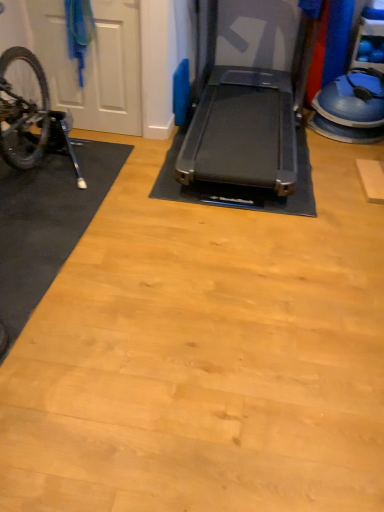
In order to face black rubber treadmill at center, should I rotate leftwards or rightwards?

Turn right by 8.000 degrees to look at black rubber treadmill at center.

What do you see at coordinates (93, 65) in the screenshot?
I see `white matte door at left` at bounding box center [93, 65].

What is the approximate width of black rubber mat at left?

The width of black rubber mat at left is 34.91 inches.

Identify the location of black rubber treadmill at center. (250, 135).

Is shiny metallic bicycle at left completely or partially inside black rubber treadmill at center?

Definitely not — shiny metallic bicycle at left is not inside black rubber treadmill at center.

Which object is closer to the camera taking this photo, black rubber treadmill at center or shiny metallic bicycle at left?

Positioned in front is black rubber treadmill at center.

How different are the orientations of black rubber treadmill at center and shiny metallic bicycle at left in degrees?

They differ by 0.608 degrees in their facing directions.

Does point (248, 179) appear closer or farther from the camera than point (37, 105)?

Point (248, 179).

Looking at this image, measure the distance from black rubber treadmill at center to white matte door at left.

A distance of 35.71 inches exists between black rubber treadmill at center and white matte door at left.

From the image's perspective, is black rubber treadmill at center above white matte door at left?

Yes, from the image's perspective, black rubber treadmill at center is on top of white matte door at left.

Which is closer to the camera, (x=272, y=111) or (x=101, y=25)?

The point (x=101, y=25) is more forward.

Is white matte door at left inside black rubber treadmill at center?

Definitely not — white matte door at left is not inside black rubber treadmill at center.

In the image, there is a black rubber treadmill at center. In order to click on bicycle below it (from the image's perspective) in this screenshot , I will do `click(30, 114)`.

Is shiny metallic bicycle at left with black rubber treadmill at center?

No, shiny metallic bicycle at left is not with black rubber treadmill at center.

From a real-world perspective, which is physically below, shiny metallic bicycle at left or black rubber treadmill at center?

In real-world perspective, shiny metallic bicycle at left is lower.

Does point (21, 141) appear closer or farther from the camera than point (307, 210)?

Point (21, 141).

From a real-world perspective, is white matte door at left located higher than black rubber mat at left?

Yes, from a real-world perspective, white matte door at left is over black rubber mat at left

Considering the sizes of white matte door at left and black rubber mat at left in the image, is white matte door at left bigger or smaller than black rubber mat at left?

Considering their sizes, white matte door at left takes up less space than black rubber mat at left.

Where is `garage door located above the black rubber mat at left (from a real-world perspective)`? This screenshot has height=512, width=384. garage door located above the black rubber mat at left (from a real-world perspective) is located at coordinates (93, 65).

Can you confirm if white matte door at left is wider than black rubber mat at left?

In fact, white matte door at left might be narrower than black rubber mat at left.

From a real-world perspective, is black rubber mat at left located beneath shiny metallic bicycle at left?

Yes, from a real-world perspective, black rubber mat at left is under shiny metallic bicycle at left.

Between black rubber mat at left and shiny metallic bicycle at left, which one is positioned behind?

Positioned behind is shiny metallic bicycle at left.

Between black rubber mat at left and shiny metallic bicycle at left, which one appears on the left side from the viewer's perspective?

black rubber mat at left is more to the left.

From the image's perspective, is black rubber mat at left positioned above or below shiny metallic bicycle at left?

black rubber mat at left is below shiny metallic bicycle at left.

From a real-world perspective, is black rubber mat at left positioned above or below black rubber treadmill at center?

From a real-world perspective, black rubber mat at left is physically below black rubber treadmill at center.

In the scene shown: Is black rubber mat at left far away from black rubber treadmill at center?

Absolutely, black rubber mat at left is distant from black rubber treadmill at center.

Considering the sizes of objects black rubber mat at left and black rubber treadmill at center in the image provided, who is bigger, black rubber mat at left or black rubber treadmill at center?

With larger size is black rubber treadmill at center.

From the image's perspective, does shiny metallic bicycle at left appear higher than white matte door at left?

Incorrect, from the image's perspective, shiny metallic bicycle at left is lower than white matte door at left.

How distant is shiny metallic bicycle at left from white matte door at left?

20.66 inches.

Considering the relative sizes of shiny metallic bicycle at left and white matte door at left in the image provided, is shiny metallic bicycle at left wider than white matte door at left?

Indeed, shiny metallic bicycle at left has a greater width compared to white matte door at left.

Considering the sizes of shiny metallic bicycle at left and white matte door at left in the image, is shiny metallic bicycle at left taller or shorter than white matte door at left?

shiny metallic bicycle at left is shorter than white matte door at left.

Find the location of a particular element. This screenshot has height=512, width=384. treadmill located above the shiny metallic bicycle at left (from the image's perspective) is located at coordinates (250, 135).

Locate an element on the screen. Image resolution: width=384 pixels, height=512 pixels. treadmill in front of the white matte door at left is located at coordinates (250, 135).

Considering their positions, is black rubber treadmill at center positioned further to black rubber mat at left than white matte door at left?

black rubber treadmill at center lies further to black rubber mat at left than the other object.

From the image, which object appears to be nearer to white matte door at left, black rubber mat at left or black rubber treadmill at center?

black rubber mat at left lies closer to white matte door at left than the other object.

Considering their positions, is white matte door at left positioned further to black rubber treadmill at center than shiny metallic bicycle at left?

shiny metallic bicycle at left is positioned further to the anchor black rubber treadmill at center.

Based on their spatial positions, is white matte door at left or black rubber mat at left further from shiny metallic bicycle at left?

white matte door at left is further to shiny metallic bicycle at left.

Based on their spatial positions, is black rubber mat at left or shiny metallic bicycle at left closer to white matte door at left?

shiny metallic bicycle at left is closer to white matte door at left.

Looking at the image, which one is located further to black rubber mat at left, black rubber treadmill at center or shiny metallic bicycle at left?

black rubber treadmill at center.

Considering their positions, is black rubber mat at left positioned closer to black rubber treadmill at center than shiny metallic bicycle at left?

black rubber mat at left is positioned closer to the anchor black rubber treadmill at center.

Which object lies nearer to the anchor point shiny metallic bicycle at left, white matte door at left or black rubber treadmill at center?

white matte door at left.

At what (x,y) coordinates should I click in order to perform the action: click on garage door between black rubber mat at left and black rubber treadmill at center. Please return your answer as a coordinate pair (x, y). Looking at the image, I should click on (93, 65).

This screenshot has width=384, height=512. What are the coordinates of `garage door between shiny metallic bicycle at left and black rubber treadmill at center from left to right` in the screenshot? It's located at (93, 65).

This screenshot has width=384, height=512. I want to click on bicycle between black rubber mat at left and black rubber treadmill at center in the horizontal direction, so click(x=30, y=114).

In order to click on bicycle between black rubber mat at left and white matte door at left along the z-axis in this screenshot , I will do `click(30, 114)`.